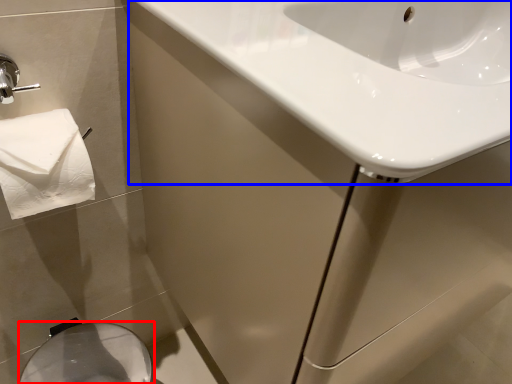
Question: Which of the following is the farthest to the observer, bidet (highlighted by a red box) or sink (highlighted by a blue box)?

Choices:
 (A) bidet
 (B) sink

Answer: (A)